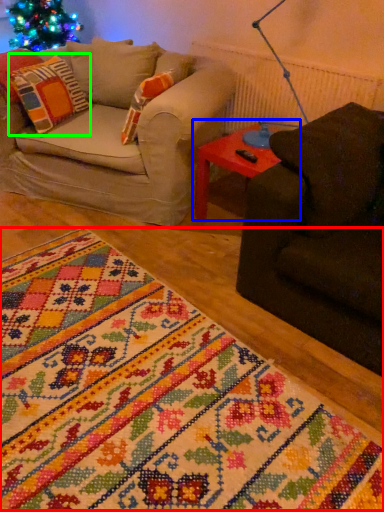
Question: Based on their relative distances, which object is farther from blanket (highlighted by a red box)? Choose from table (highlighted by a blue box) and pillow (highlighted by a green box).

Choices:
 (A) table
 (B) pillow

Answer: (B)